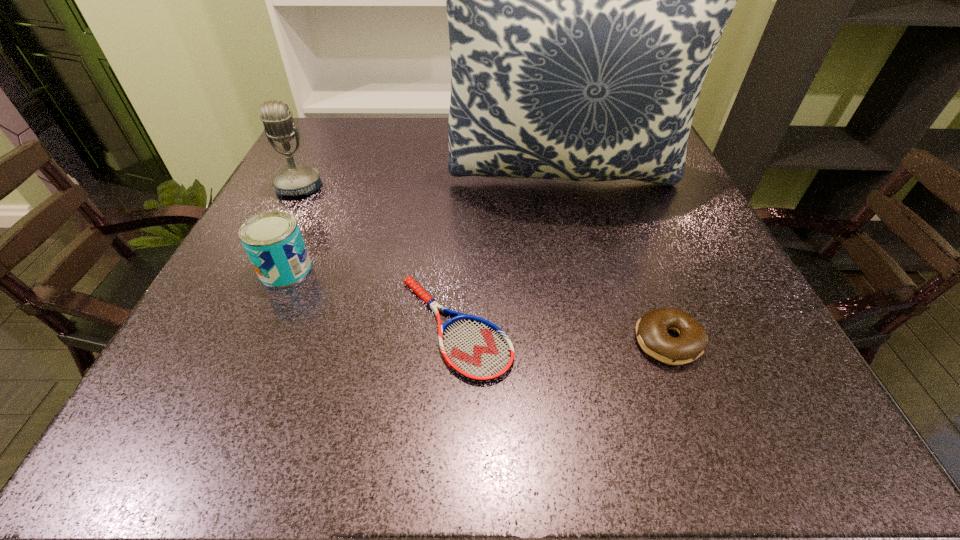
Locate an element on the screen. The height and width of the screenshot is (540, 960). object positioned at the far edge is located at coordinates (585, 0).

Locate an element on the screen. The height and width of the screenshot is (540, 960). microphone present at the left edge is located at coordinates (294, 180).

In order to click on can situated at the left edge in this screenshot , I will do `click(272, 240)`.

The image size is (960, 540). Find the location of `cushion located at the right edge`. cushion located at the right edge is located at coordinates (585, 0).

Locate an element on the screen. doughnut situated at the right edge is located at coordinates (651, 329).

Locate an element on the screen. object located at the far right corner is located at coordinates (585, 0).

This screenshot has width=960, height=540. Find the location of `free space at the far edge of the desktop`. free space at the far edge of the desktop is located at coordinates (393, 120).

Where is `blank space at the near edge of the desktop`? blank space at the near edge of the desktop is located at coordinates (375, 423).

At what (x,y) coordinates should I click in order to perform the action: click on free space at the left edge. Please return your answer as a coordinate pair (x, y). Looking at the image, I should click on pos(203,363).

Locate an element on the screen. Image resolution: width=960 pixels, height=540 pixels. vacant space at the right edge of the desktop is located at coordinates (747, 364).